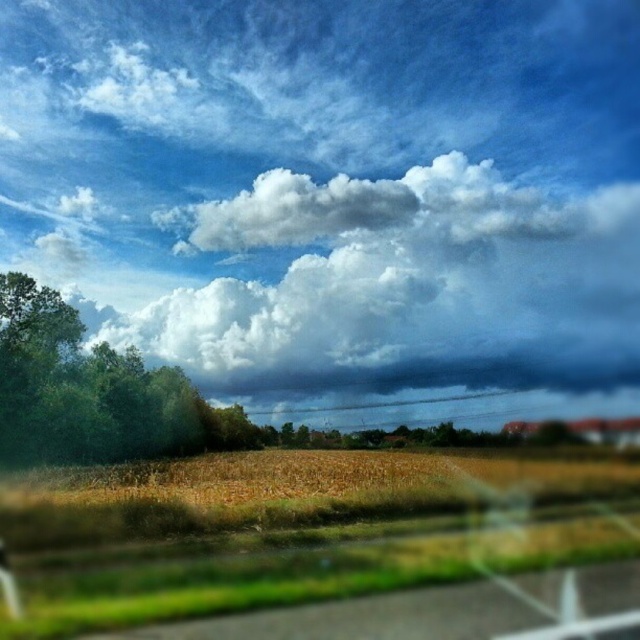
Question: Among these points, which one is farthest from the camera?

Choices:
 (A) (228, 444)
 (B) (150, 346)

Answer: (B)

Question: Among these points, which one is nearest to the camera?

Choices:
 (A) (604, 250)
 (B) (13, 417)

Answer: (B)

Question: Which of the following is the farthest from the observer?

Choices:
 (A) (548, 257)
 (B) (234, 404)

Answer: (A)

Question: Can you confirm if white fluffy cloud at upper center is wider than green leafy tree at left?

Choices:
 (A) no
 (B) yes

Answer: (B)

Question: Where is white fluffy cloud at upper center located in relation to green leafy tree at left in the image?

Choices:
 (A) left
 (B) right

Answer: (B)

Question: Can you confirm if white fluffy cloud at upper center is thinner than green leafy tree at left?

Choices:
 (A) yes
 (B) no

Answer: (B)